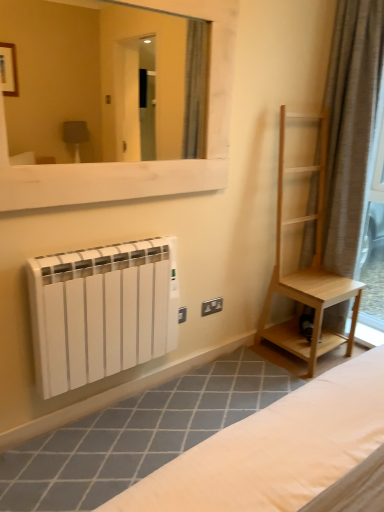
Locate an element on the screen. The image size is (384, 512). vacant area situated below white matte radiator at lower left (from a real-world perspective) is located at coordinates (109, 408).